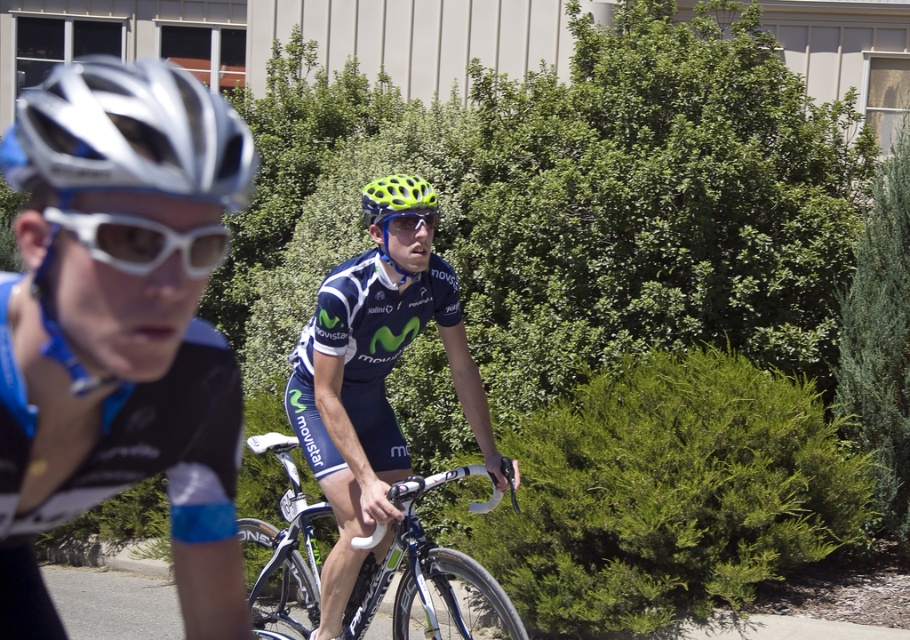
Question: Does matte blue cycling jersey at center have a lesser width compared to neon green matte helmet at center?

Choices:
 (A) no
 (B) yes

Answer: (A)

Question: Can you confirm if white matte/glossy goggles at left is bigger than neon green matte helmet at center?

Choices:
 (A) yes
 (B) no

Answer: (B)

Question: Estimate the real-world distances between objects in this image. Which object is farther from the neon green matte helmet at center?

Choices:
 (A) matte blue cycling jersey at center
 (B) silver metallic helmet at left
 (C) silver/matte bicycle helmet at upper left

Answer: (B)

Question: Which object is the closest to the clear plastic goggles at center?

Choices:
 (A) silver metallic helmet at left
 (B) neon green matte helmet at center

Answer: (B)

Question: Which of these objects is positioned farthest from the neon green matte helmet at center?

Choices:
 (A) matte blue cycling jersey at center
 (B) neon yellow mesh bicycle helmet at center
 (C) white matte/glossy goggles at left

Answer: (C)

Question: Does matte blue cycling jersey at center appear over neon green matte helmet at center?

Choices:
 (A) yes
 (B) no

Answer: (B)